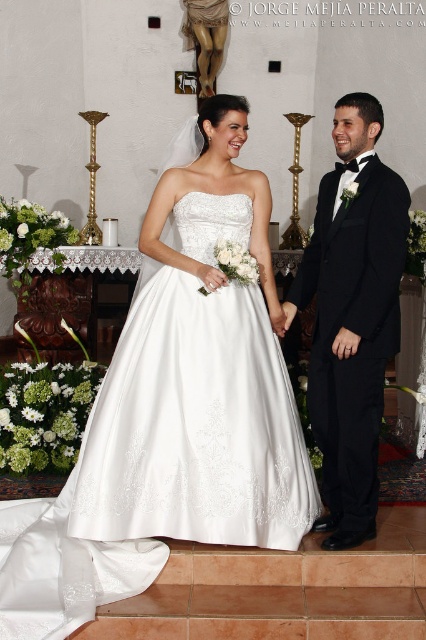
Question: Which point is farther from the camera taking this photo?

Choices:
 (A) (206, 269)
 (B) (345, 500)

Answer: (B)

Question: Does white satin dress at center lie in front of black satin tuxedo at right?

Choices:
 (A) no
 (B) yes

Answer: (B)

Question: Among these points, which one is farthest from the camera?

Choices:
 (A) (140, 528)
 (B) (339, 276)

Answer: (B)

Question: Is white satin dress at center thinner than black satin tuxedo at right?

Choices:
 (A) yes
 (B) no

Answer: (B)

Question: Can you confirm if white satin dress at center is positioned above black satin tuxedo at right?

Choices:
 (A) no
 (B) yes

Answer: (B)